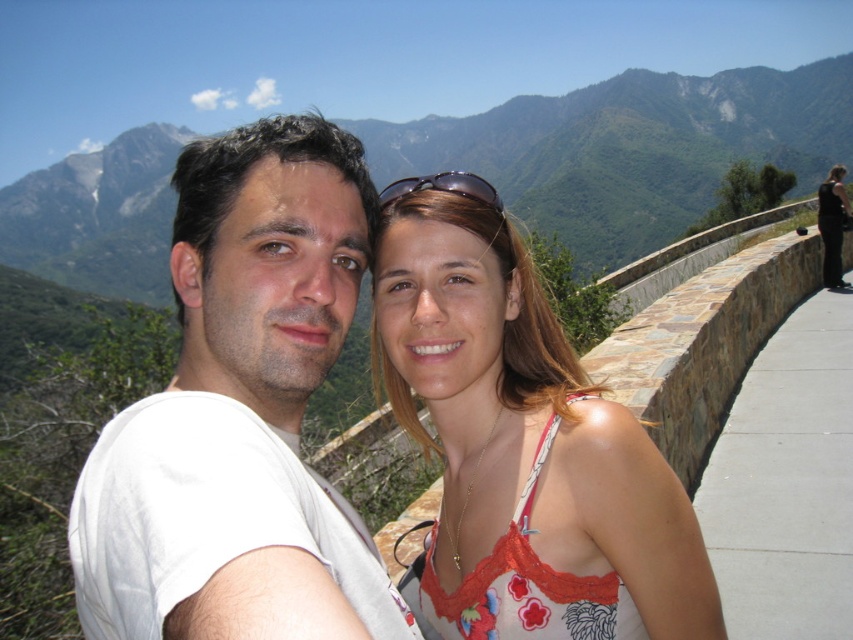
Does white cotton t-shirt at center have a larger size compared to sunglasses at center?

Yes, white cotton t-shirt at center is bigger than sunglasses at center.

Does white cotton t-shirt at center have a lesser height compared to sunglasses at center?

In fact, white cotton t-shirt at center may be taller than sunglasses at center.

Find the location of a particular element. white cotton t-shirt at center is located at coordinates (241, 413).

Can you confirm if floral lace tank top at center is thinner than black satin dress at right?

Yes.

Is point (410, 378) positioned after point (834, 269)?

No, (410, 378) is closer to viewer.

Where is `floral lace tank top at center`? The width and height of the screenshot is (853, 640). floral lace tank top at center is located at coordinates (525, 449).

What are the coordinates of `floral lace tank top at center` in the screenshot? It's located at (525, 449).

Does black satin dress at right lie behind sunglasses at center?

Yes, it is behind sunglasses at center.

Which is more to the right, black satin dress at right or sunglasses at center?

black satin dress at right

Which is in front, point (837, 266) or point (381, 204)?

Point (381, 204) is more forward.

Where is `black satin dress at right`? This screenshot has width=853, height=640. black satin dress at right is located at coordinates (833, 225).